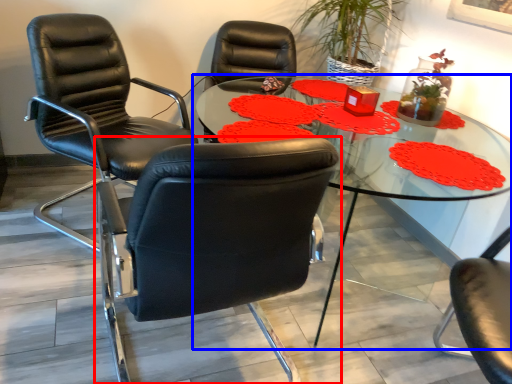
Question: Which object is further to the camera taking this photo, chair (highlighted by a red box) or table (highlighted by a blue box)?

Choices:
 (A) chair
 (B) table

Answer: (B)